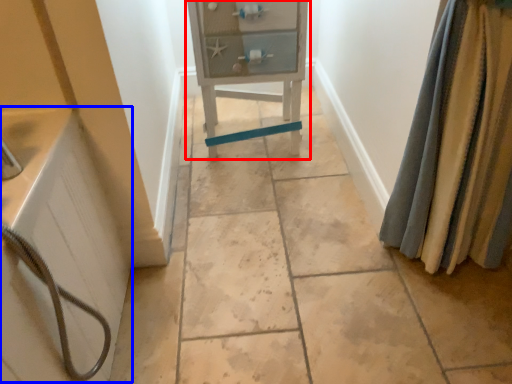
Question: Which object is closer to the camera taking this photo, furniture (highlighted by a red box) or bath (highlighted by a blue box)?

Choices:
 (A) furniture
 (B) bath

Answer: (B)